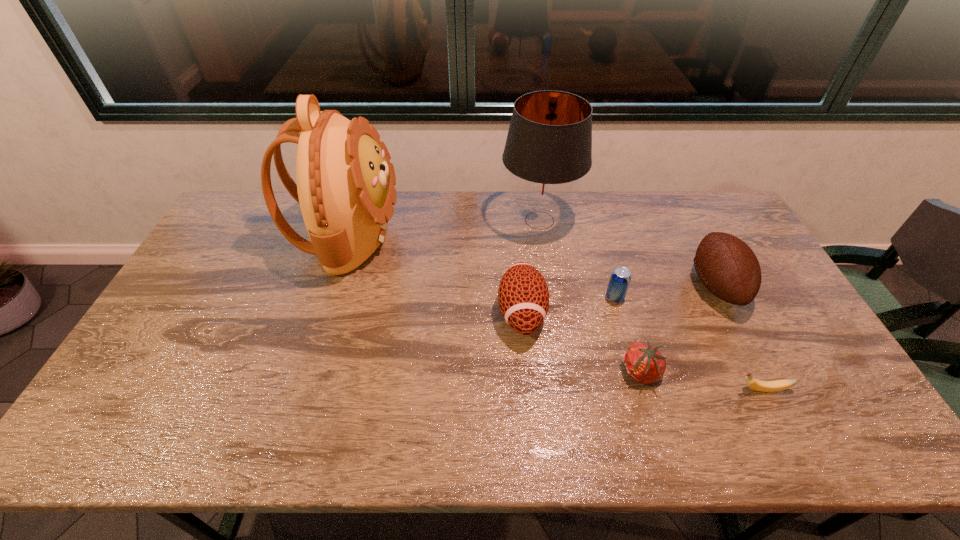
Where is `vacant point located between the shortest object and the right football`? vacant point located between the shortest object and the right football is located at coordinates (738, 337).

At what (x,y) coordinates should I click in order to perform the action: click on free space between the leftmost object and the tomato. Please return your answer as a coordinate pair (x, y). Looking at the image, I should click on (494, 305).

Find the location of `free area in between the banana and the lampshade`. free area in between the banana and the lampshade is located at coordinates (650, 305).

I want to click on vacant region between the right football and the fifth tallest object, so pos(665,291).

Choose which object is the third nearest neighbor to the backpack. Please provide its 2D coordinates. Your answer should be formatted as a tuple, i.e. [(x, y)], where the tuple contains the x and y coordinates of a point satisfying the conditions above.

[(620, 278)]

Point out which object is positioned as the sixth nearest to the left football. Please provide its 2D coordinates. Your answer should be formatted as a tuple, i.e. [(x, y)], where the tuple contains the x and y coordinates of a point satisfying the conditions above.

[(727, 266)]

Where is `blank area in the image that satisfies the following two spatial constraints: 1. on the front side of the lampshade; 2. on the front-facing side of the leftmost object`? blank area in the image that satisfies the following two spatial constraints: 1. on the front side of the lampshade; 2. on the front-facing side of the leftmost object is located at coordinates (542, 237).

Find the location of a particular element. The image size is (960, 540). vacant space that satisfies the following two spatial constraints: 1. on the front-facing side of the tomato; 2. on the right side of the leftmost object is located at coordinates (304, 373).

Image resolution: width=960 pixels, height=540 pixels. I want to click on free location that satisfies the following two spatial constraints: 1. on the laces of the right football; 2. on the front side of the left football, so (x=731, y=313).

Locate an element on the screen. The width and height of the screenshot is (960, 540). vacant point that satisfies the following two spatial constraints: 1. on the front-facing side of the leftmost object; 2. on the left side of the tomato is located at coordinates (304, 373).